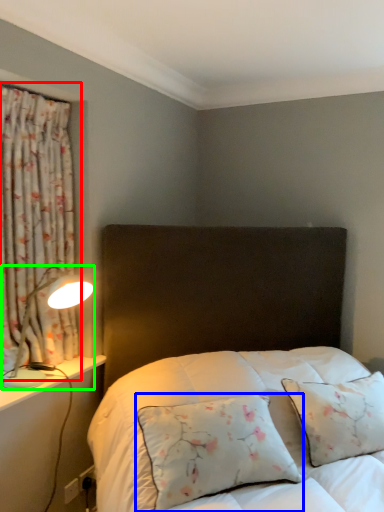
Question: Which object is the farthest from curtain (highlighted by a red box)? Choose among these: pillow (highlighted by a blue box) or table lamp (highlighted by a green box).

Choices:
 (A) pillow
 (B) table lamp

Answer: (A)